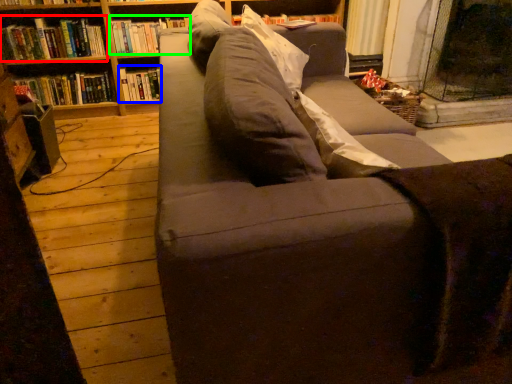
Question: Which object is positioned closest to book (highlighted by a red box)? Select from book (highlighted by a blue box) and book (highlighted by a green box).

Choices:
 (A) book
 (B) book

Answer: (B)